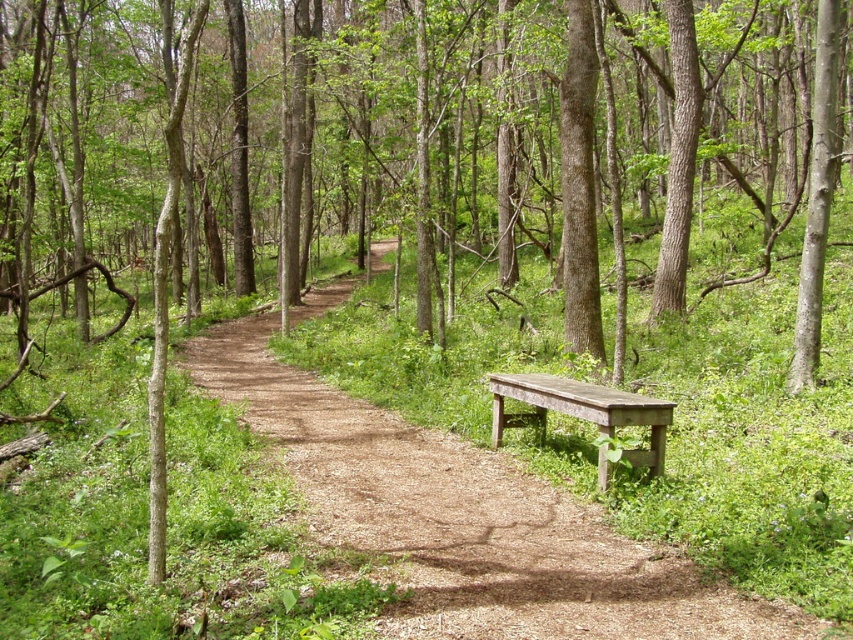
Does wooden bench at right appear under weathered wood bench at right?

Yes, wooden bench at right is below weathered wood bench at right.

Is wooden bench at right above weathered wood bench at right?

No, wooden bench at right is not above weathered wood bench at right.

Between point (646, 561) and point (538, 387), which one is positioned behind?

Positioned behind is point (538, 387).

At what (x,y) coordinates should I click in order to perform the action: click on wooden bench at right. Please return your answer as a coordinate pair (x, y). The image size is (853, 640). Looking at the image, I should click on (466, 518).